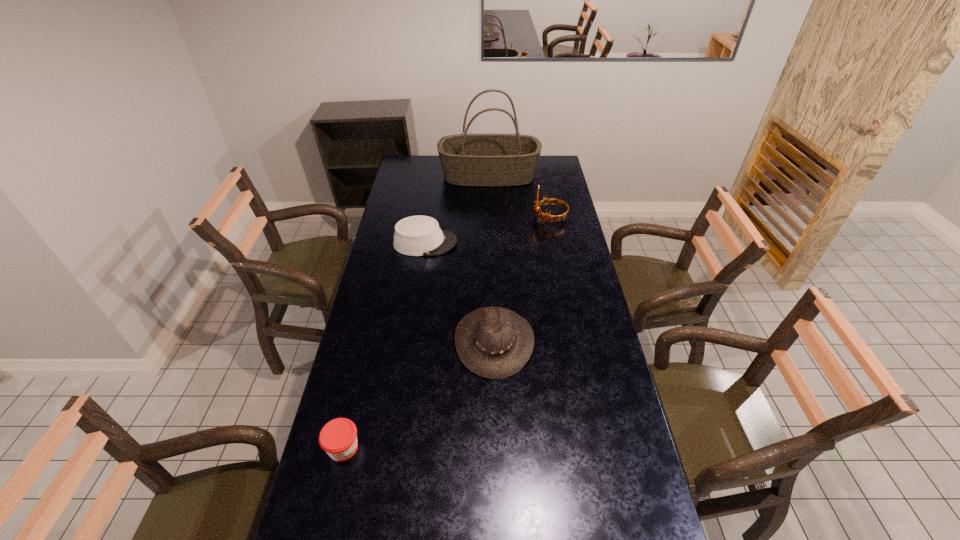
Where is `the farthest object`? The width and height of the screenshot is (960, 540). the farthest object is located at coordinates (485, 160).

Where is `basket`? This screenshot has width=960, height=540. basket is located at coordinates (485, 160).

At what (x,y) coordinates should I click in order to perform the action: click on tiara. Please return your answer as a coordinate pair (x, y). The image size is (960, 540). Looking at the image, I should click on (550, 201).

The width and height of the screenshot is (960, 540). I want to click on the fourth nearest object, so pyautogui.click(x=550, y=201).

In order to click on the nearer hat in this screenshot , I will do `click(495, 343)`.

Locate an element on the screen. Image resolution: width=960 pixels, height=540 pixels. the right hat is located at coordinates (495, 343).

The width and height of the screenshot is (960, 540). Identify the location of the farther hat. (419, 235).

Find the location of `the third nearest object`. the third nearest object is located at coordinates (419, 235).

You are a GUI agent. You are given a task and a screenshot of the screen. Output one action in this format:
    pyautogui.click(x=<x>, y=<y>)
    Task: Click on the shortest object
    The image size is (960, 540).
    Given the screenshot: What is the action you would take?
    pyautogui.click(x=338, y=438)

At what (x,y) coordinates should I click in order to perform the action: click on the nearest object. Please return your answer as a coordinate pair (x, y). The height and width of the screenshot is (540, 960). Looking at the image, I should click on (338, 438).